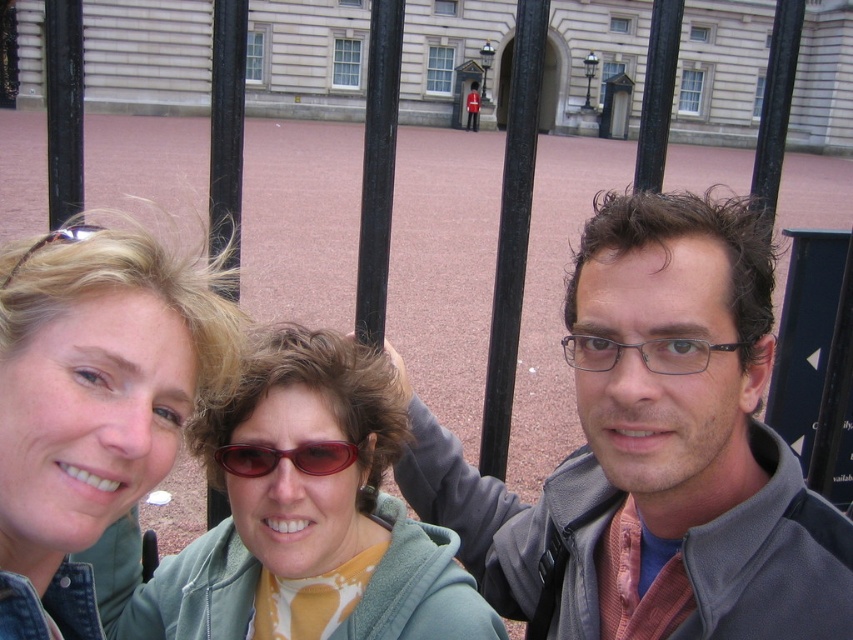
Question: Can you confirm if transparent plastic glasses at center is bigger than sunglasses at center?

Choices:
 (A) no
 (B) yes

Answer: (B)

Question: Which object appears closest to the camera in this image?

Choices:
 (A) gray fleece jacket at center
 (B) transparent plastic glasses at center
 (C) denim jacket at lower left

Answer: (A)

Question: Based on their relative distances, which object is nearer to the sunglasses at center?

Choices:
 (A) transparent plastic glasses at center
 (B) denim jacket at lower left

Answer: (B)

Question: Is the position of matte green hoodie at center more distant than that of denim jacket at lower left?

Choices:
 (A) yes
 (B) no

Answer: (A)

Question: Which point is farther from the camera taking this photo?

Choices:
 (A) (61, 522)
 (B) (668, 360)

Answer: (B)

Question: Can you confirm if denim jacket at lower left is positioned to the left of transparent plastic glasses at center?

Choices:
 (A) yes
 (B) no

Answer: (A)